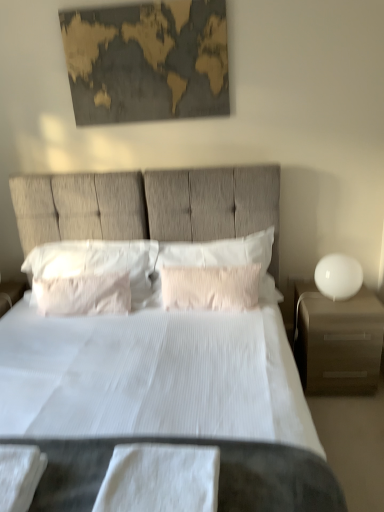
At what (x,y) coordinates should I click in order to perform the action: click on vacant point above matte brown nightstand at right (from a real-world perspective). Please return your answer as a coordinate pair (x, y). Looking at the image, I should click on (336, 303).